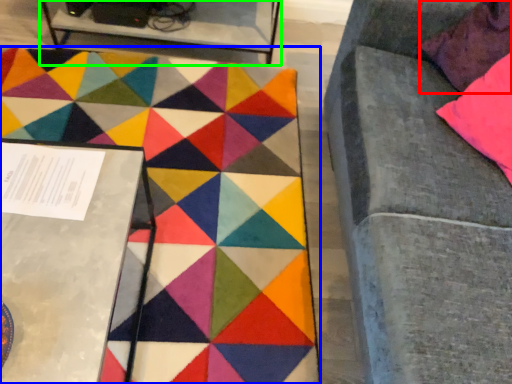
Question: Based on their relative distances, which object is nearer to pillow (highlighted by a red box)? Choose from mat (highlighted by a blue box) and table (highlighted by a green box).

Choices:
 (A) mat
 (B) table

Answer: (A)